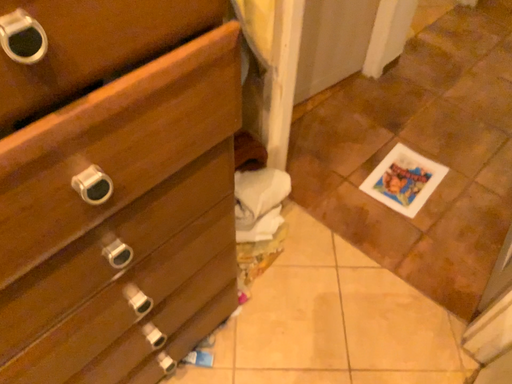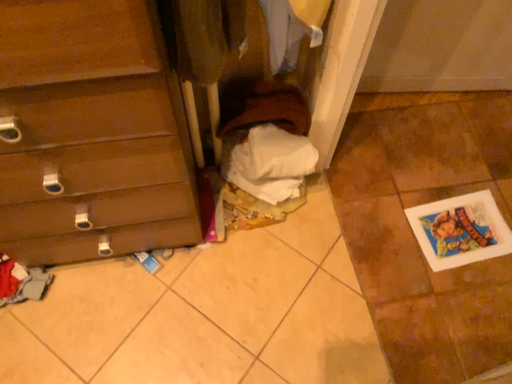
Question: Which way did the camera rotate in the video?

Choices:
 (A) rotated left
 (B) rotated right

Answer: (A)